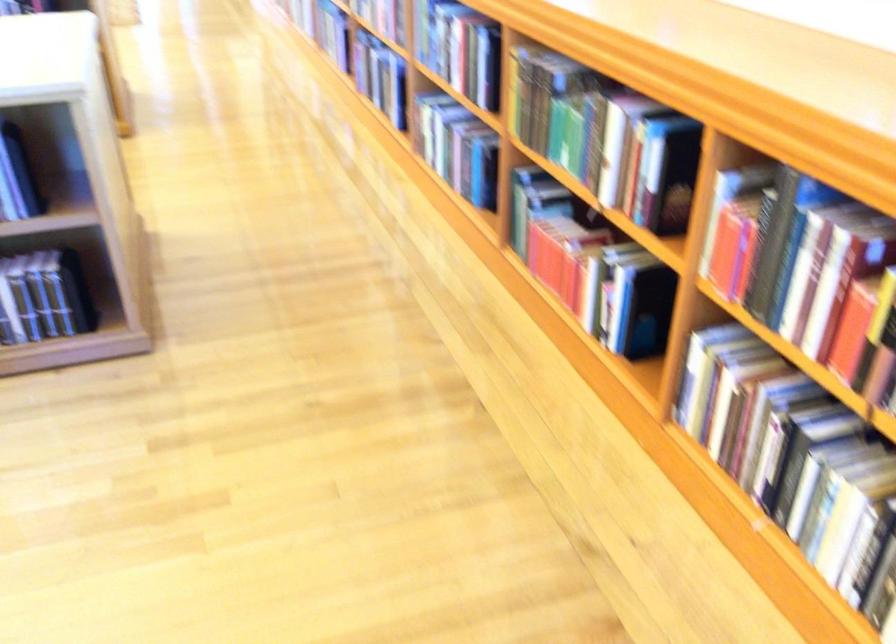
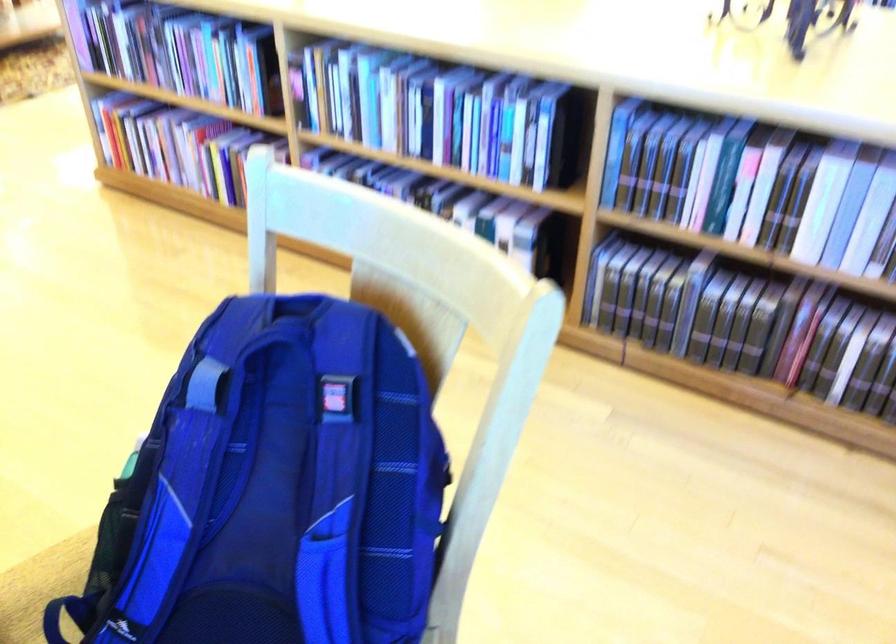
Question: The first image is from the beginning of the video and the second image is from the end. How did the camera likely rotate when shooting the video?

Choices:
 (A) Left
 (B) Right
 (C) Up
 (D) Down

Answer: (A)